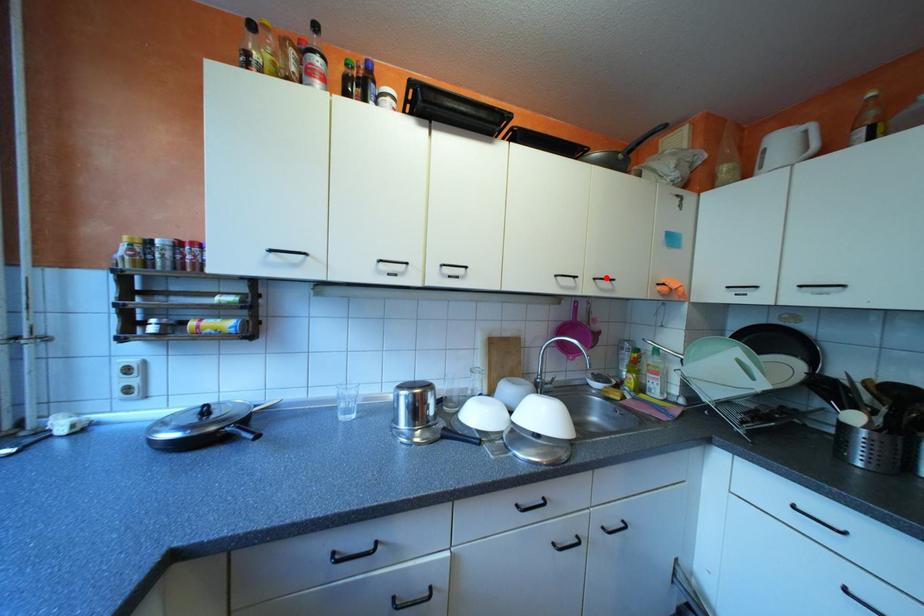
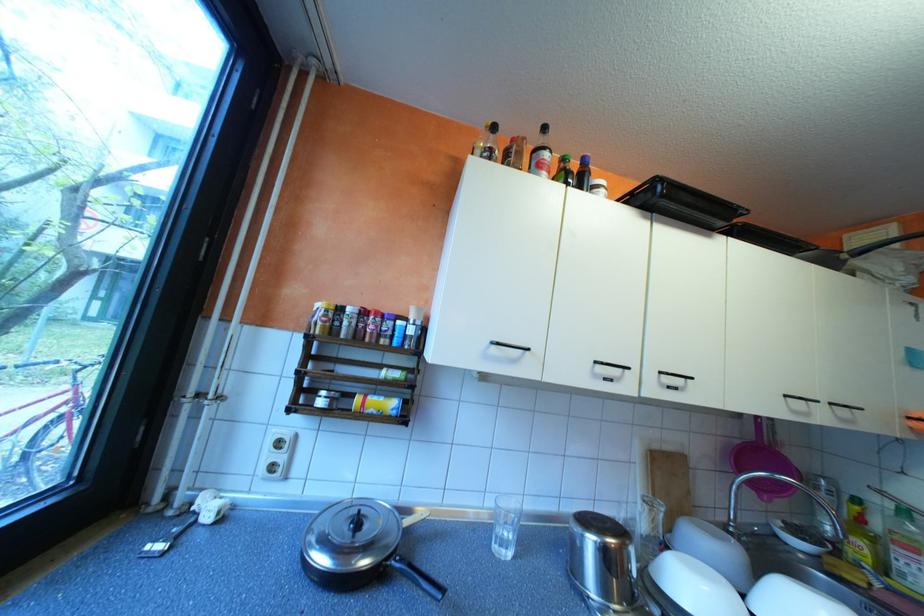
Locate, in the second image, the point that corresponds to the highlighted location in the first image.

(843, 403)